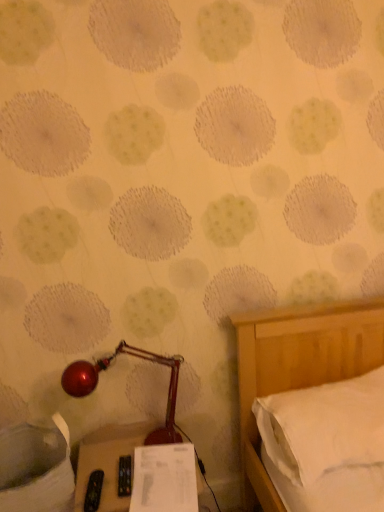
Where is `free point below shiny red lamp at lower left (from a real-world perspective)`? This screenshot has width=384, height=512. free point below shiny red lamp at lower left (from a real-world perspective) is located at coordinates (126, 451).